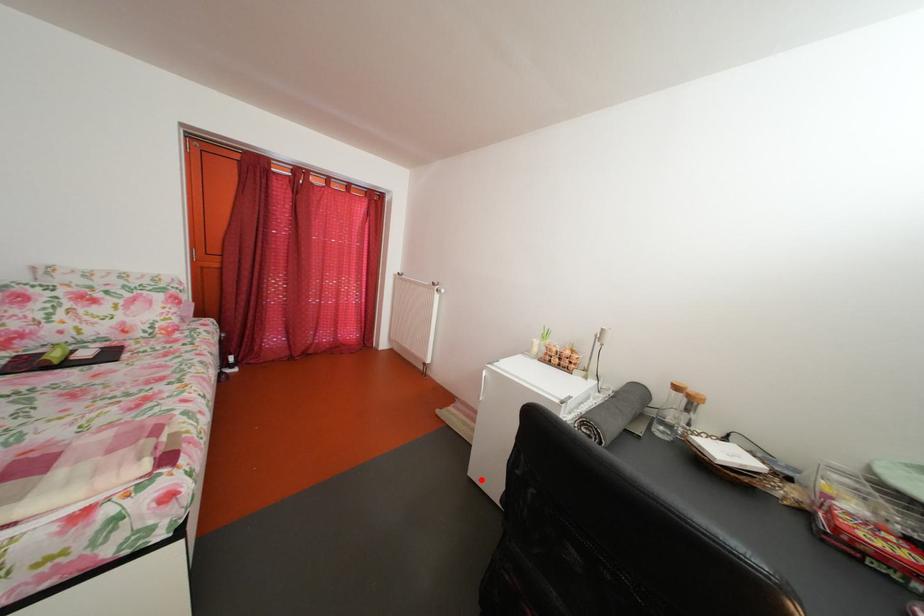
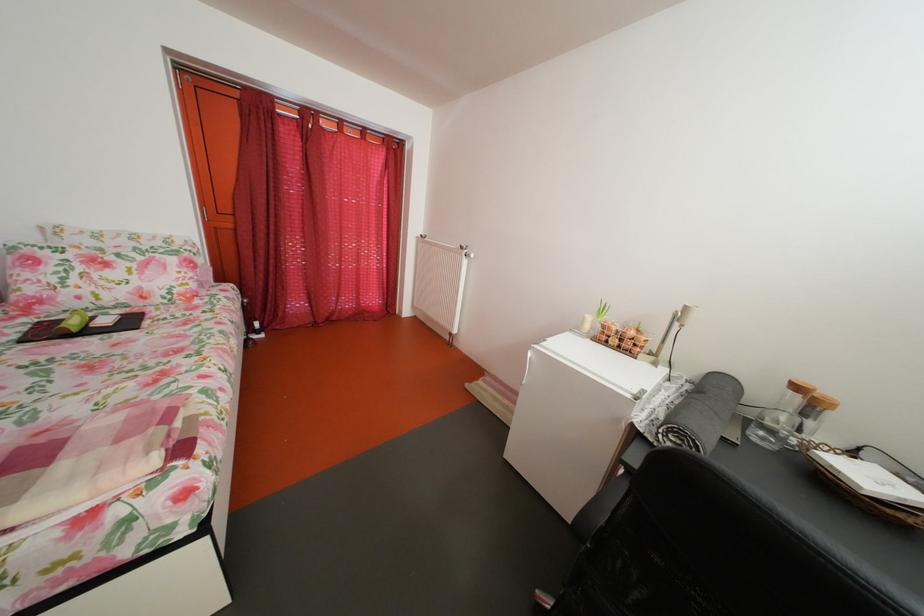
Locate, in the second image, the point that corresponds to the highlighted location in the first image.

(517, 463)